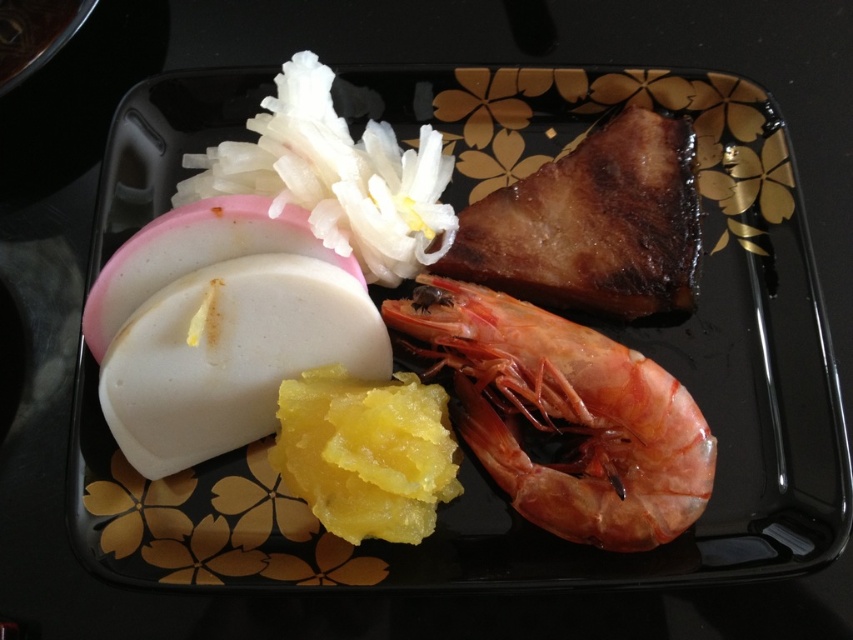
Between white creamy cheese at center-left and brown glazed meat at upper right, which one has less height?

white creamy cheese at center-left is shorter.

Identify the location of white creamy cheese at center-left. (230, 355).

The width and height of the screenshot is (853, 640). Describe the element at coordinates (230, 355) in the screenshot. I see `white creamy cheese at center-left` at that location.

Image resolution: width=853 pixels, height=640 pixels. In order to click on white creamy cheese at center-left in this screenshot , I will do `click(230, 355)`.

Is shiny red prawn at center above white creamy cheese at center-left?

Incorrect, shiny red prawn at center is not positioned above white creamy cheese at center-left.

Does shiny red prawn at center have a lesser height compared to white creamy cheese at center-left?

No.

Where is `shiny red prawn at center`? Image resolution: width=853 pixels, height=640 pixels. shiny red prawn at center is located at coordinates (564, 413).

Does shiny red prawn at center appear over brown glazed meat at upper right?

Incorrect, shiny red prawn at center is not positioned above brown glazed meat at upper right.

Is shiny red prawn at center behind brown glazed meat at upper right?

No, shiny red prawn at center is closer to the viewer.

Does point (666, 502) come closer to viewer compared to point (636, 125)?

Yes, point (666, 502) is closer to viewer.

The width and height of the screenshot is (853, 640). Find the location of `shiny red prawn at center`. shiny red prawn at center is located at coordinates (564, 413).